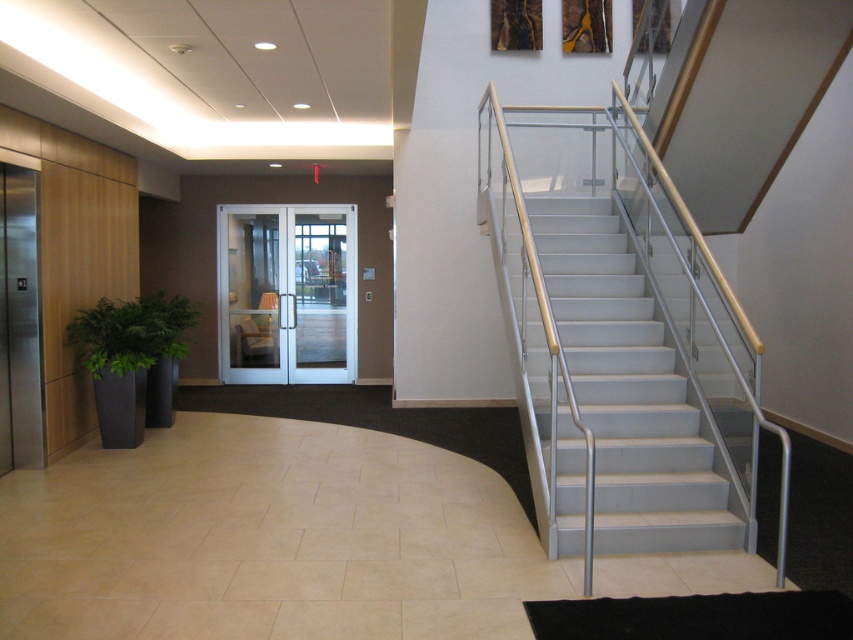
You are standing at the entrance of the building and want to take the elevator to the second floor. The white glass elevator at center and the green leafy plant at left are in your line of sight. Which object is closer to you?

The green leafy plant at left is closer to you because the white glass elevator at center is positioned over it, meaning the plant is behind the elevator in your line of sight.

You are standing in the hallway of the modern building and want to go upstairs. You see the white glossy stairs at right and the white glass elevator at center. Which one is located to the right side of the other?

The white glossy stairs at right is to the right of the white glass elevator at center.

You are an office worker who needs to move a large delivery box from the entrance to the storage room. The box is too big to fit through narrow spaces. Based on the image, which object between the white glossy stairs at right and the white glass elevator at center would you choose to transport the box?

The white glossy stairs at right is larger in size than the white glass elevator at center, so you should choose the white glossy stairs at right to transport the large delivery box since it can accommodate larger items.